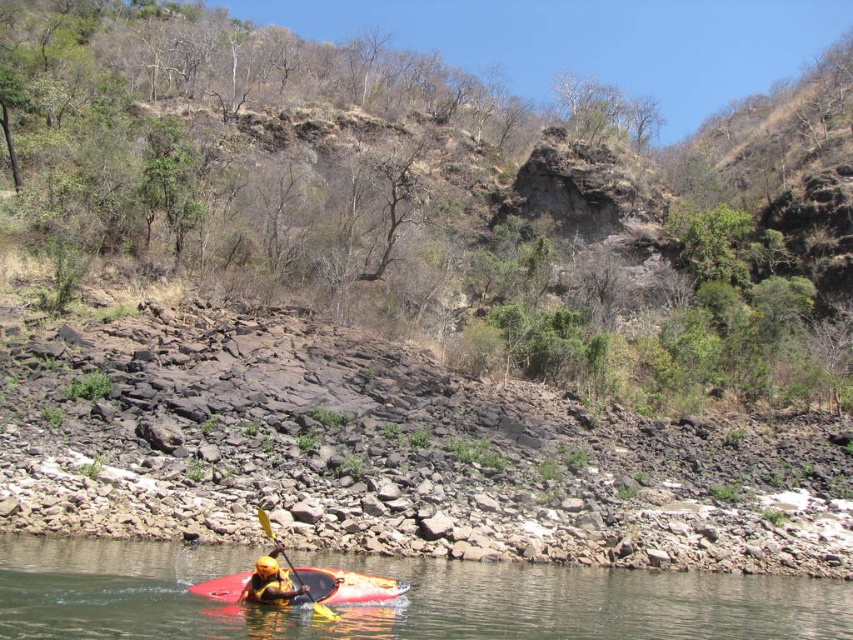
Can you confirm if rocky at lower center is thinner than matte red kayak at lower center?

No, rocky at lower center is not thinner than matte red kayak at lower center.

How far apart are rocky at lower center and matte red kayak at lower center?

rocky at lower center is 14.28 meters away from matte red kayak at lower center.

In order to click on rocky at lower center in this screenshot , I will do `click(392, 452)`.

Is rubber kayak at lower center thinner than yellow matte helmet at lower center?

No.

Is point (526, 612) farther from viewer compared to point (271, 561)?

Yes, point (526, 612) is behind point (271, 561).

Locate an element on the screen. rubber kayak at lower center is located at coordinates (401, 600).

Can you confirm if rubber kayak at lower center is shorter than matte red kayak at lower center?

No, rubber kayak at lower center is not shorter than matte red kayak at lower center.

This screenshot has width=853, height=640. What do you see at coordinates (401, 600) in the screenshot? I see `rubber kayak at lower center` at bounding box center [401, 600].

The height and width of the screenshot is (640, 853). I want to click on rubber kayak at lower center, so click(401, 600).